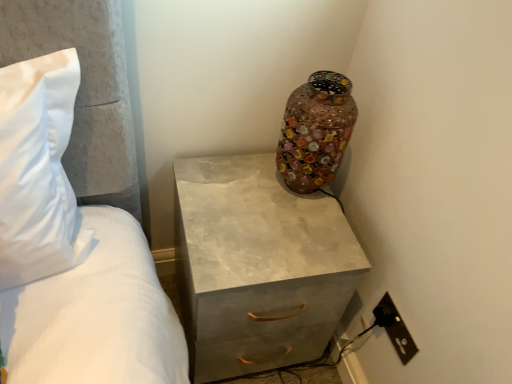
Question: Considering the relative positions of black plastic outlet at lower right and matte concrete chest of drawers at center in the image provided, is black plastic outlet at lower right to the right of matte concrete chest of drawers at center from the viewer's perspective?

Choices:
 (A) yes
 (B) no

Answer: (A)

Question: Is black plastic outlet at lower right wider than matte concrete chest of drawers at center?

Choices:
 (A) no
 (B) yes

Answer: (A)

Question: Is black plastic outlet at lower right looking in the opposite direction of matte concrete chest of drawers at center?

Choices:
 (A) yes
 (B) no

Answer: (B)

Question: From a real-world perspective, does black plastic outlet at lower right stand above matte concrete chest of drawers at center?

Choices:
 (A) no
 (B) yes

Answer: (B)

Question: Considering the relative positions of black plastic outlet at lower right and matte concrete chest of drawers at center in the image provided, is black plastic outlet at lower right behind matte concrete chest of drawers at center?

Choices:
 (A) no
 (B) yes

Answer: (B)

Question: Is black plastic outlet at lower right at the left side of matte concrete chest of drawers at center?

Choices:
 (A) yes
 (B) no

Answer: (B)

Question: Is multicolored mosaic vase at upper right not inside black plastic outlet at lower right?

Choices:
 (A) no
 (B) yes

Answer: (B)

Question: Considering the relative sizes of multicolored mosaic vase at upper right and black plastic outlet at lower right in the image provided, is multicolored mosaic vase at upper right taller than black plastic outlet at lower right?

Choices:
 (A) yes
 (B) no

Answer: (A)

Question: Considering the relative positions of multicolored mosaic vase at upper right and black plastic outlet at lower right in the image provided, is multicolored mosaic vase at upper right to the left of black plastic outlet at lower right from the viewer's perspective?

Choices:
 (A) no
 (B) yes

Answer: (B)

Question: Does multicolored mosaic vase at upper right have a lesser height compared to black plastic outlet at lower right?

Choices:
 (A) yes
 (B) no

Answer: (B)

Question: Is multicolored mosaic vase at upper right oriented towards black plastic outlet at lower right?

Choices:
 (A) yes
 (B) no

Answer: (B)

Question: Can you confirm if multicolored mosaic vase at upper right is wider than black plastic outlet at lower right?

Choices:
 (A) yes
 (B) no

Answer: (A)

Question: Is matte concrete chest of drawers at center not inside black plastic outlet at lower right?

Choices:
 (A) yes
 (B) no

Answer: (A)